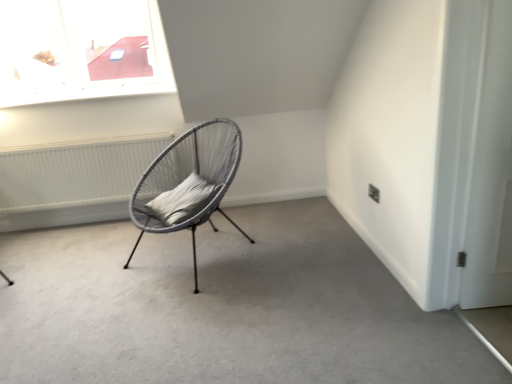
Question: Can you confirm if matte gray chair at center is thinner than white textured radiator at left?

Choices:
 (A) no
 (B) yes

Answer: (A)

Question: Is matte gray chair at center outside of white textured radiator at left?

Choices:
 (A) no
 (B) yes

Answer: (B)

Question: Is white textured radiator at left completely or partially inside matte gray chair at center?

Choices:
 (A) no
 (B) yes

Answer: (A)

Question: Is matte gray chair at center turned away from white textured radiator at left?

Choices:
 (A) no
 (B) yes

Answer: (A)

Question: Considering the relative positions of matte gray chair at center and white textured radiator at left in the image provided, is matte gray chair at center to the right of white textured radiator at left from the viewer's perspective?

Choices:
 (A) yes
 (B) no

Answer: (A)

Question: Does matte gray chair at center come behind white textured radiator at left?

Choices:
 (A) yes
 (B) no

Answer: (B)

Question: Is gray fabric pillow at center looking in the opposite direction of white matte door at right?

Choices:
 (A) yes
 (B) no

Answer: (B)

Question: Does gray fabric pillow at center have a larger size compared to white matte door at right?

Choices:
 (A) no
 (B) yes

Answer: (B)

Question: Considering the relative positions of gray fabric pillow at center and white matte door at right in the image provided, is gray fabric pillow at center to the right of white matte door at right from the viewer's perspective?

Choices:
 (A) no
 (B) yes

Answer: (A)

Question: Would you say gray fabric pillow at center contains white matte door at right?

Choices:
 (A) no
 (B) yes

Answer: (A)

Question: Is gray fabric pillow at center completely or partially outside of white matte door at right?

Choices:
 (A) yes
 (B) no

Answer: (A)

Question: Is gray fabric pillow at center behind white matte door at right?

Choices:
 (A) no
 (B) yes

Answer: (B)

Question: Is gray fabric pillow at center oriented away from matte gray chair at center?

Choices:
 (A) no
 (B) yes

Answer: (A)